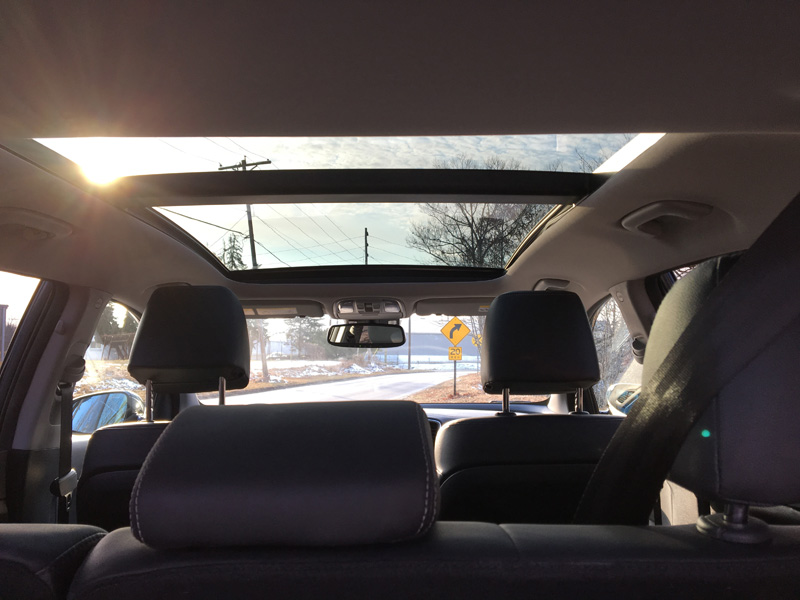
Identify the location of mirror. The height and width of the screenshot is (600, 800). (109, 404).